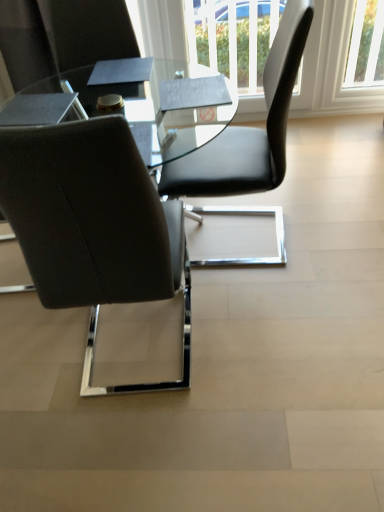
Identify the location of vacant space underneath black leather chair at upper right, acting as the 2th chair starting from the left (from a real-world perspective). (251, 234).